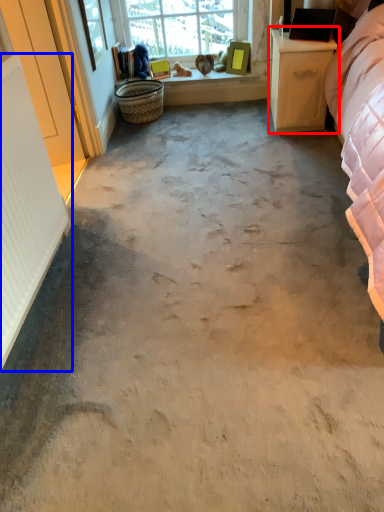
Question: Which object is closer to the camera taking this photo, nightstand (highlighted by a red box) or radiator (highlighted by a blue box)?

Choices:
 (A) nightstand
 (B) radiator

Answer: (B)